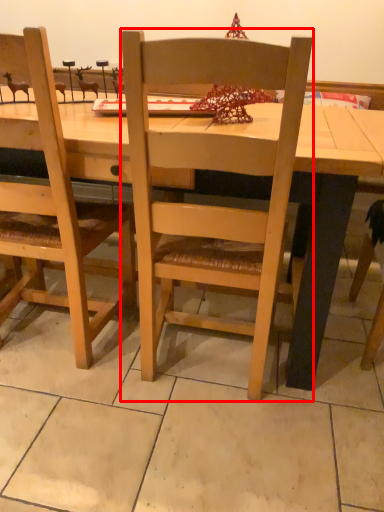
Question: From the image's perspective, what is the correct spatial relationship of chair (annotated by the red box) in relation to desk?

Choices:
 (A) below
 (B) above

Answer: (A)